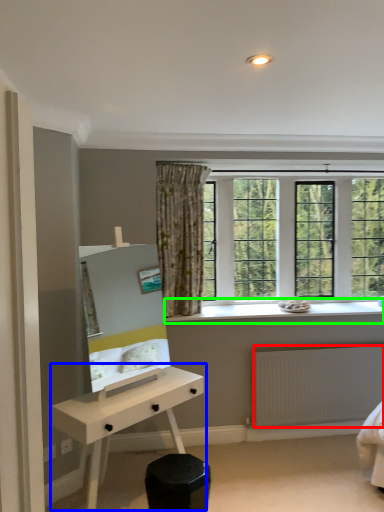
Question: Which object is the closest to the radiator (highlighted by a red box)? Choose among these: desk (highlighted by a blue box) or window sill (highlighted by a green box).

Choices:
 (A) desk
 (B) window sill

Answer: (B)